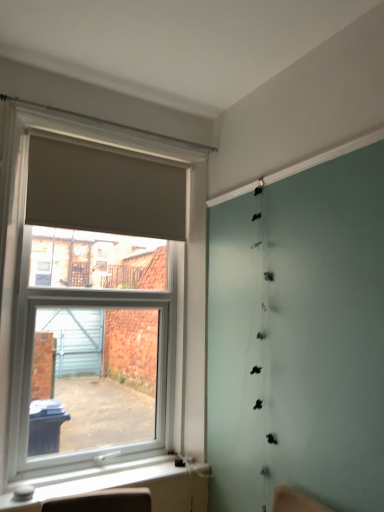
Question: Is matte beige curtain at upper left at the back of white plastic window sill at lower left?

Choices:
 (A) no
 (B) yes

Answer: (A)

Question: Is there a large distance between white plastic window sill at lower left and matte beige curtain at upper left?

Choices:
 (A) no
 (B) yes

Answer: (B)

Question: From a real-world perspective, is white plastic window sill at lower left located higher than matte beige curtain at upper left?

Choices:
 (A) no
 (B) yes

Answer: (A)

Question: Can you confirm if white plastic window sill at lower left is wider than matte beige curtain at upper left?

Choices:
 (A) yes
 (B) no

Answer: (A)

Question: Can you confirm if white plastic window sill at lower left is shorter than matte beige curtain at upper left?

Choices:
 (A) yes
 (B) no

Answer: (A)

Question: In the image, is matte beige curtain at upper left positioned in front of or behind matte gray roller blind at left?

Choices:
 (A) front
 (B) behind

Answer: (B)

Question: Does point (115, 221) appear closer or farther from the camera than point (137, 297)?

Choices:
 (A) farther
 (B) closer

Answer: (B)

Question: Is matte beige curtain at upper left situated inside matte gray roller blind at left or outside?

Choices:
 (A) outside
 (B) inside

Answer: (B)

Question: Looking at their shapes, would you say matte beige curtain at upper left is wider or thinner than matte gray roller blind at left?

Choices:
 (A) wide
 (B) thin

Answer: (B)

Question: From a real-world perspective, is matte beige curtain at upper left above or below white plastic window sill at lower left?

Choices:
 (A) above
 (B) below

Answer: (A)

Question: Looking at the image, does matte beige curtain at upper left seem bigger or smaller compared to white plastic window sill at lower left?

Choices:
 (A) big
 (B) small

Answer: (A)

Question: Is matte beige curtain at upper left wider or thinner than white plastic window sill at lower left?

Choices:
 (A) wide
 (B) thin

Answer: (B)

Question: Considering the positions of matte beige curtain at upper left and white plastic window sill at lower left in the image, is matte beige curtain at upper left taller or shorter than white plastic window sill at lower left?

Choices:
 (A) tall
 (B) short

Answer: (A)

Question: Based on their positions, is white plastic window sill at lower left located to the left or right of matte gray roller blind at left?

Choices:
 (A) left
 (B) right

Answer: (B)

Question: Looking at the image, does white plastic window sill at lower left seem bigger or smaller compared to matte gray roller blind at left?

Choices:
 (A) small
 (B) big

Answer: (A)